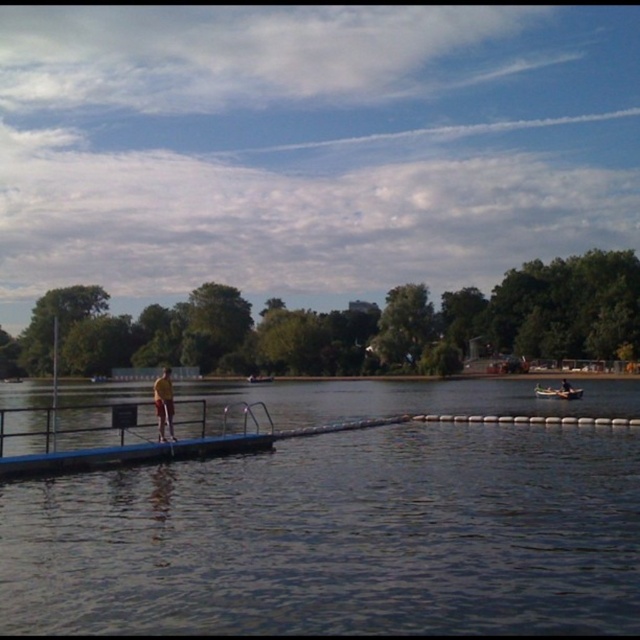
You are a swimmer planning to cross the lake from the diving board. You see the dark blue water at center and the wooden canoe at center. Which one is wider?

The dark blue water at center is wider than the wooden canoe at center according to the description.

You are planning to take a photo of the yellow fabric person at center and the wooden canoe at center. Which one should you focus on to ensure both are in the frame without cropping?

You should focus on the wooden canoe at center because it occupies more space than the yellow fabric person at center, ensuring both fit within the frame.

Consider the image. You are planning to take a photo of the dark blue water at center and the yellow fabric person at center. Which object occupies more horizontal space in the image?

The dark blue water at center has a larger width than the yellow fabric person at center, so it occupies more horizontal space in the image.